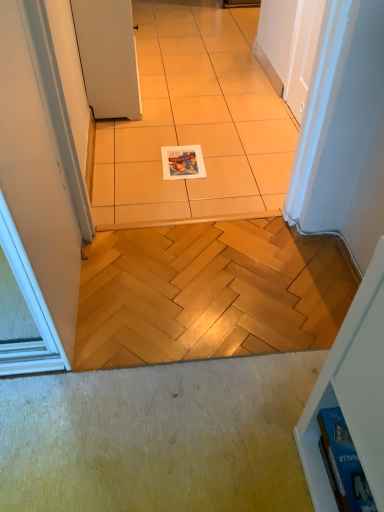
Locate an element on the screen. This screenshot has width=384, height=512. free point above matte paper magazine at center, the second magazine from the right (from a real-world perspective) is located at coordinates (183, 158).